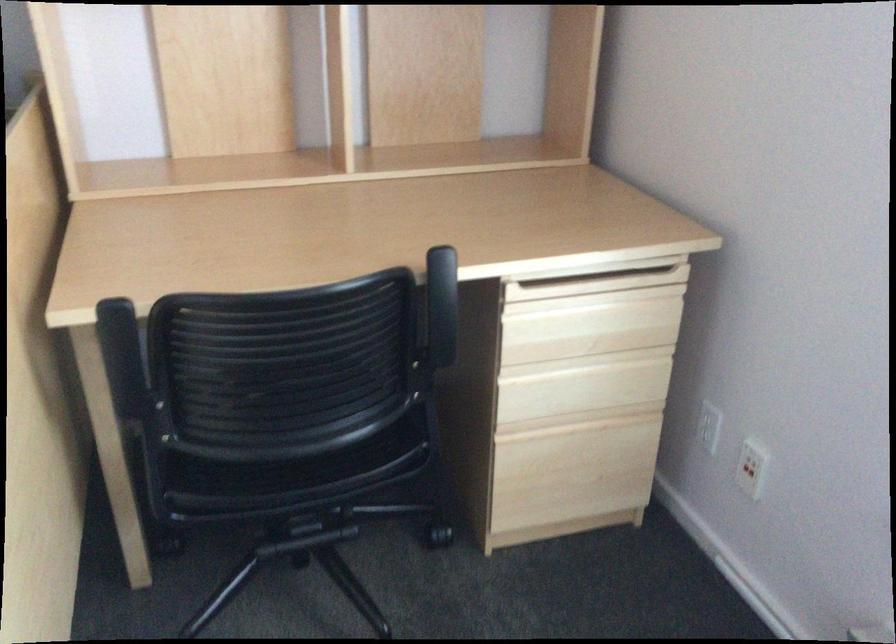
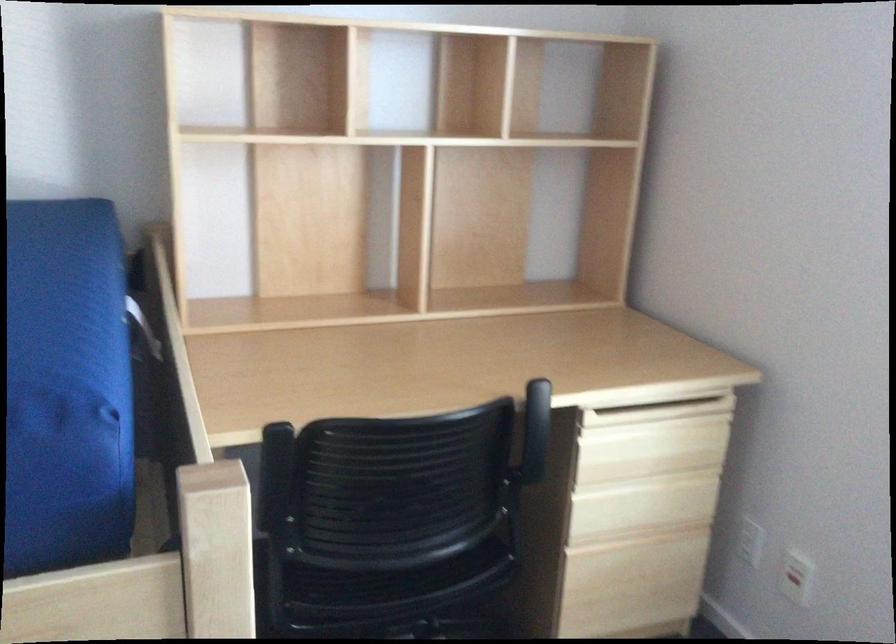
Locate, in the second image, the point that corresponds to the point at 752,464 in the first image.

(796, 576)